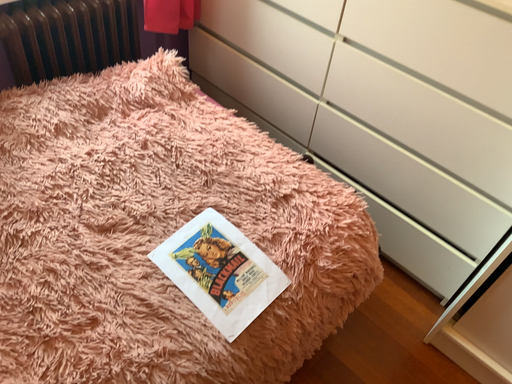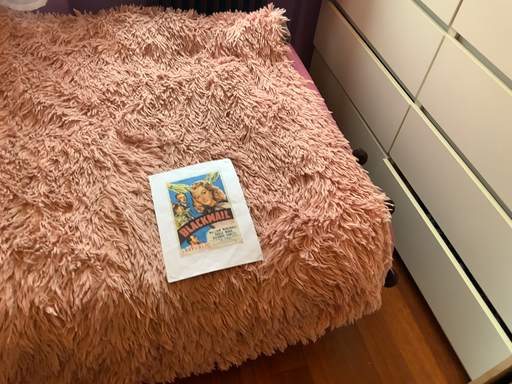
Question: Which way did the camera rotate in the video?

Choices:
 (A) rotated left
 (B) rotated right

Answer: (A)